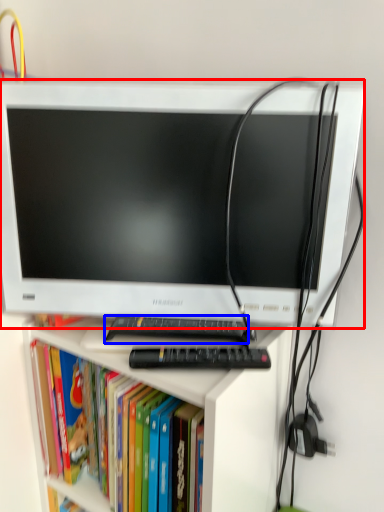
Question: Among these objects, which one is farthest to the camera, computer monitor (highlighted by a red box) or keyboard (highlighted by a blue box)?

Choices:
 (A) computer monitor
 (B) keyboard

Answer: (B)